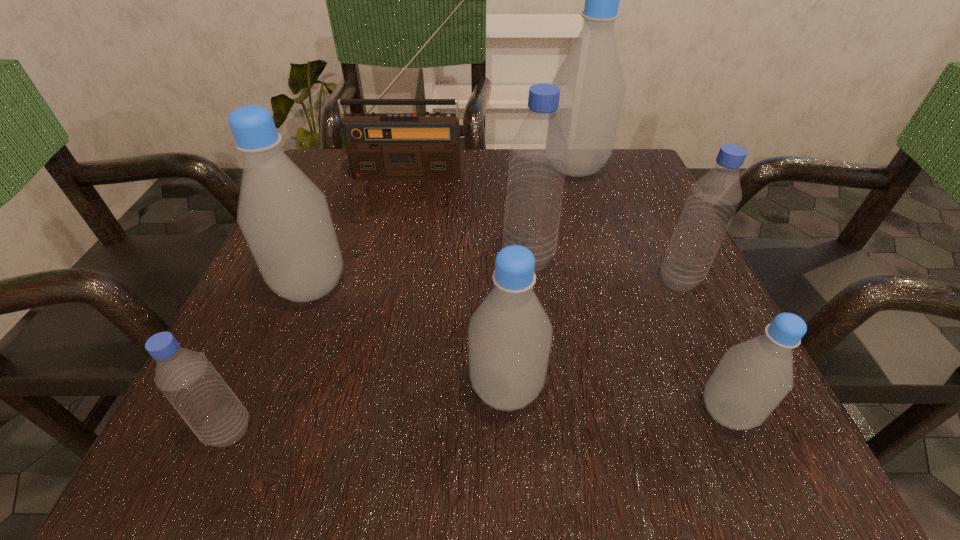
Where is `the smallest blue bottle`? the smallest blue bottle is located at coordinates (188, 380).

The image size is (960, 540). Identify the location of blank space located on the front of the farthest bottle. (604, 264).

In order to click on vacant space positioned 0.130m on the front-facing side of the radio receiver in this screenshot , I will do point(404,217).

The height and width of the screenshot is (540, 960). Identify the location of vacant space situated 0.280m on the left of the second blue bottle from right to left. (343, 260).

You are a GUI agent. You are given a task and a screenshot of the screen. Output one action in this format:
    pyautogui.click(x=<x>, y=<y>)
    Task: Click on the free space located 0.130m on the front of the second farthest gray bottle
    The height and width of the screenshot is (540, 960).
    Given the screenshot: What is the action you would take?
    pyautogui.click(x=273, y=386)

I want to click on free spot located on the front of the second biggest blue bottle, so click(x=729, y=387).

At what (x,y) coordinates should I click in order to perform the action: click on vacant area situated on the back of the third gray bottle from right to left. Please return your answer as a coordinate pair (x, y). Looking at the image, I should click on (501, 280).

Locate an element on the screen. The height and width of the screenshot is (540, 960). blank space located 0.050m on the back of the smallest gray bottle is located at coordinates (703, 356).

The height and width of the screenshot is (540, 960). Identify the location of free space located on the right of the leftmost blue bottle. (525, 431).

I want to click on bottle situated at the far edge, so click(592, 87).